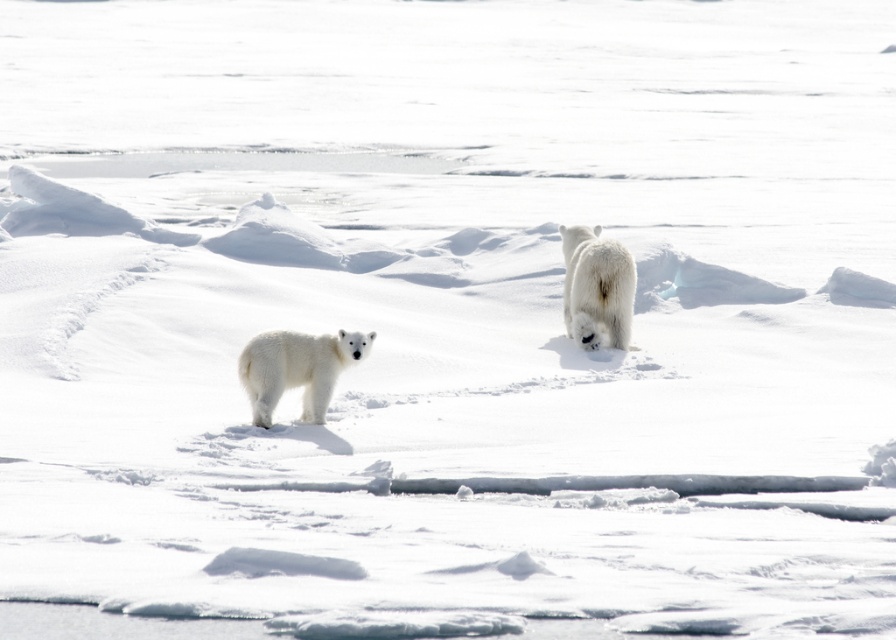
Which is more to the left, white fluffy bear at center or white fur bear at center?

From the viewer's perspective, white fluffy bear at center appears more on the left side.

Identify the location of white fluffy bear at center. (296, 369).